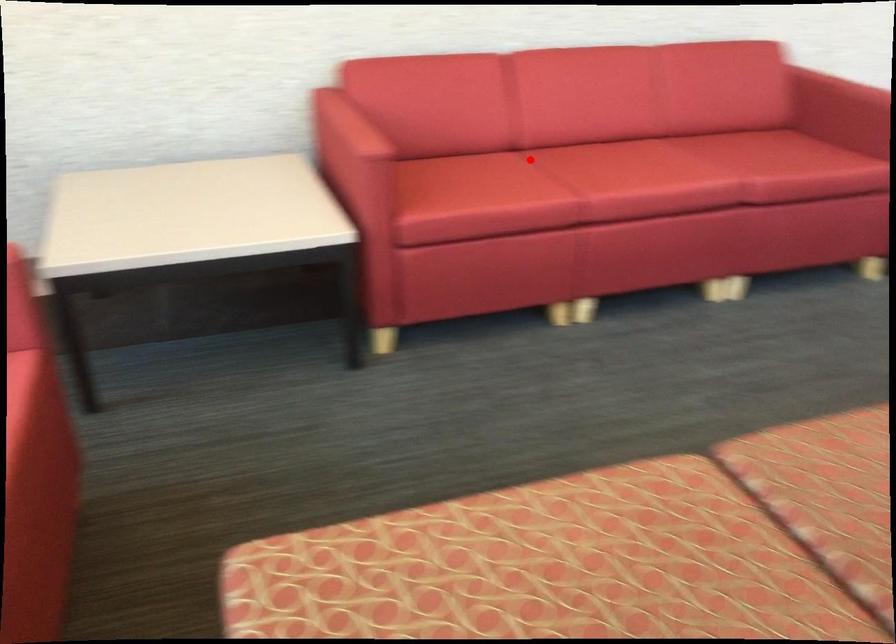
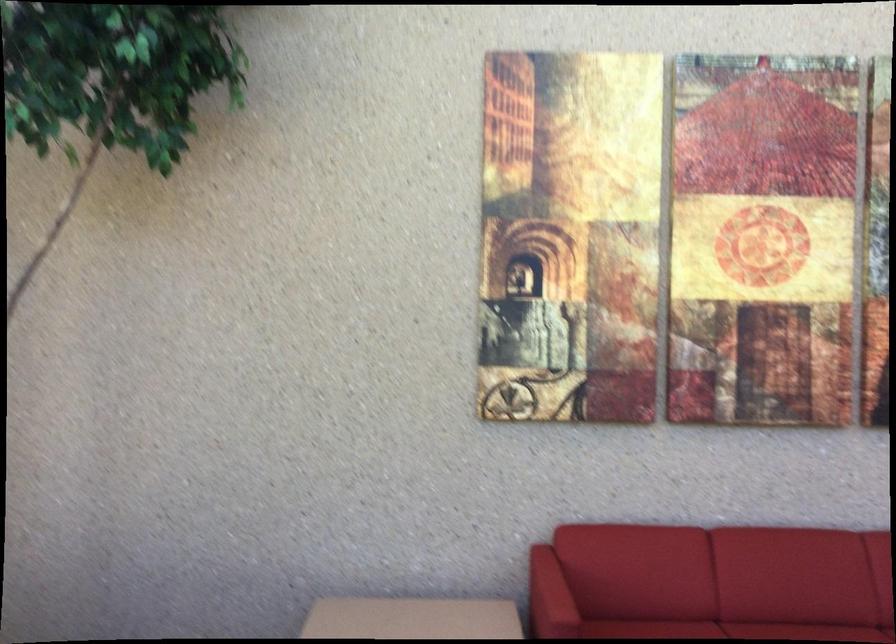
In the second image, find the point that corresponds to the highlighted location in the first image.

(727, 630)